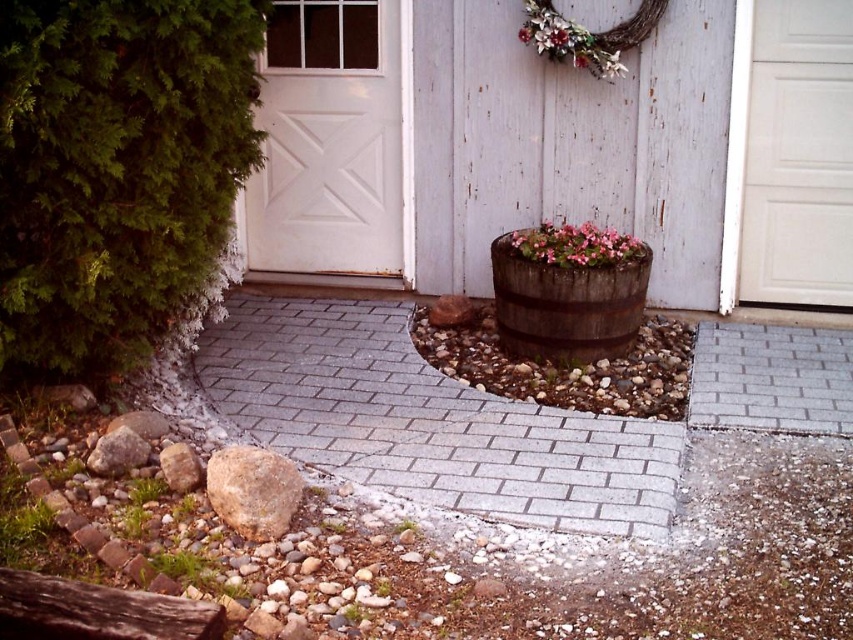
You are standing in the garden and want to reach the white door of the shed. There is a point at coordinates (793, 49) that is 5.09 meters away from you. Can you estimate how far you are from the white door?

The point at coordinates (793, 49) is 5.09 meters away from you. Since this point is near the white door, you are approximately 5.09 meters away from the white door.

You are standing in the garden and want to place a small statue exactly halfway between point (149, 317) and point (561, 33). Will the statue be closer to the white door or the gravel bed?

The statue will be closer to the white door because the halfway point between point (149, 317) and point (561, 33) is closer to the door than the gravel bed.

You are a delivery person trying to deliver a package to the white painted wood door at center. There is a green leafy plant at lower center blocking the path. Can you move the plant to the side to access the door?

The white painted wood door at center is wider than the green leafy plant at lower center, so you can move the plant to the side to access the door.